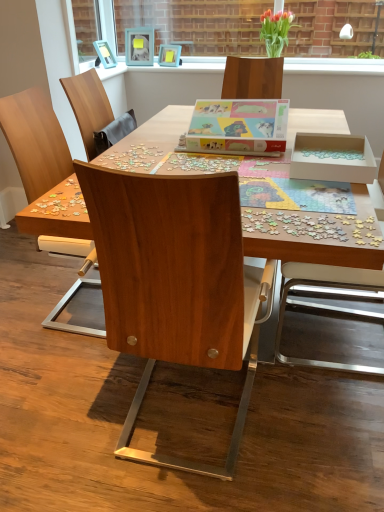
Question: Based on their sizes in the image, would you say pastel matte puzzle box at center is bigger or smaller than wooden desk at center?

Choices:
 (A) big
 (B) small

Answer: (B)

Question: In the image, is pastel matte puzzle box at center on the left side or the right side of wooden desk at center?

Choices:
 (A) right
 (B) left

Answer: (A)

Question: Which object is positioned farthest from the matte glass vase at upper center?

Choices:
 (A) wooden chair at center, placed as the third chair when sorted from right to left
 (B) teal matte picture frame at upper center, which is the 2th picture frame from right to left
 (C) clear glass vase at upper center
 (D) wooden desk at center
 (E) wooden chair at center, which is the third chair from left to right

Answer: (E)

Question: Which is nearer to the wooden chair at center, which is the third chair from left to right?

Choices:
 (A) wooden desk at center
 (B) clear glass vase at upper center
 (C) matte glass vase at upper center
 (D) pastel matte puzzle box at center
 (E) wooden chair at center, placed as the third chair when sorted from right to left

Answer: (D)